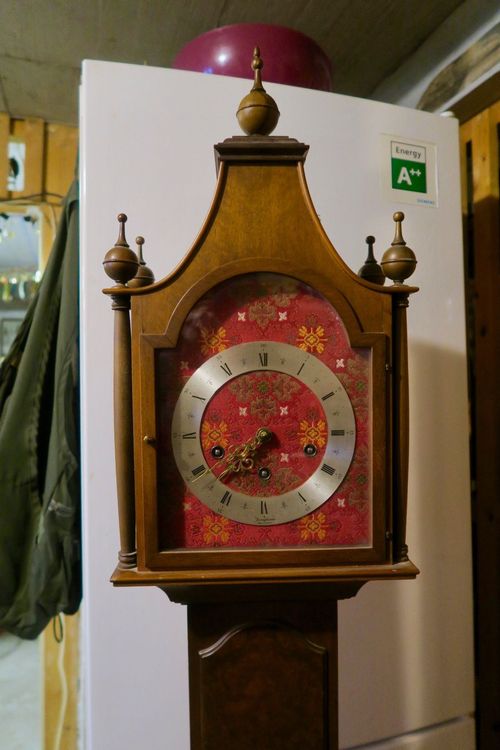
Locate an element on the screen. This screenshot has height=750, width=500. hands of clock is located at coordinates tap(244, 453).